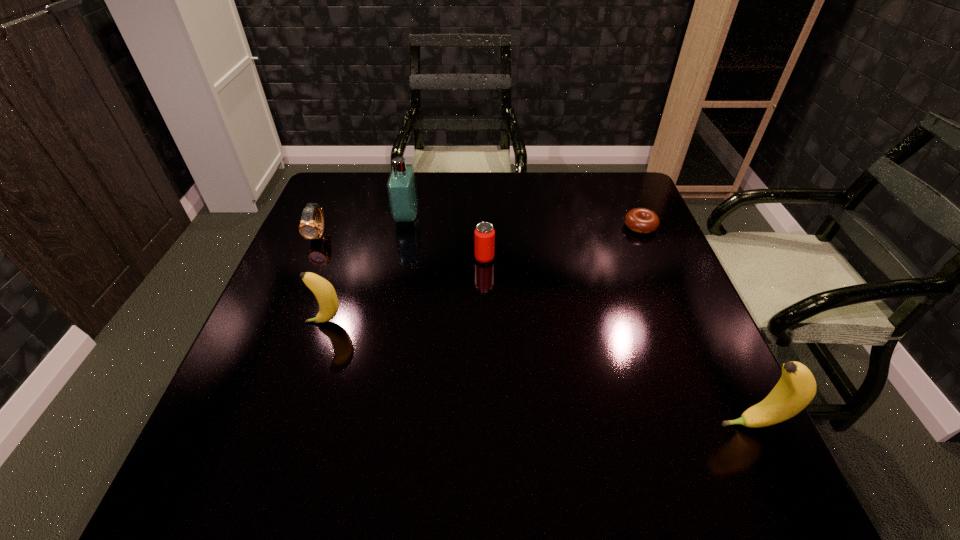
Find the location of `vacant space at the near left corner of the desktop`. vacant space at the near left corner of the desktop is located at coordinates (236, 422).

I want to click on vacant area at the far right corner of the desktop, so click(x=599, y=202).

Locate an element on the screen. The height and width of the screenshot is (540, 960). vacant position at the near right corner of the desktop is located at coordinates (674, 430).

Where is `free space between the shortest object and the third object from right to left`? This screenshot has width=960, height=540. free space between the shortest object and the third object from right to left is located at coordinates (563, 242).

Where is `vacant space that's between the fourth farthest object and the nearest object`? vacant space that's between the fourth farthest object and the nearest object is located at coordinates click(617, 341).

Image resolution: width=960 pixels, height=540 pixels. In order to click on empty location between the second nearest object and the doughnut in this screenshot , I will do `click(483, 274)`.

Locate an element on the screen. free spot between the fourth object from right to left and the watch is located at coordinates (x=363, y=226).

This screenshot has height=540, width=960. Identify the location of vacant point located between the second nearest object and the third object from right to left. (405, 290).

At what (x,y) coordinates should I click in order to perform the action: click on free spot between the beer can and the second object from left to right. Please return your answer as a coordinate pair (x, y). Looking at the image, I should click on (405, 290).

The width and height of the screenshot is (960, 540). Find the location of `free point between the taller banana and the third object from left to right`. free point between the taller banana and the third object from left to right is located at coordinates (579, 321).